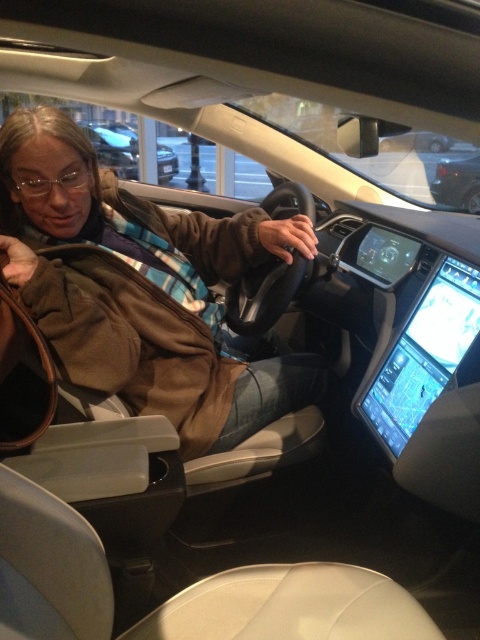
Can you confirm if metallic silver car at upper center is positioned below shiny black car at upper right?

Incorrect, metallic silver car at upper center is not positioned below shiny black car at upper right.

Locate an element on the screen. The height and width of the screenshot is (640, 480). metallic silver car at upper center is located at coordinates (115, 145).

This screenshot has height=640, width=480. I want to click on metallic silver car at upper center, so click(x=115, y=145).

Between brown leather jacket at center and shiny black car at upper right, which one appears on the left side from the viewer's perspective?

brown leather jacket at center

Measure the distance between brown leather jacket at center and camera.

brown leather jacket at center and camera are 4.28 feet apart.

Is point (303, 387) closer to camera compared to point (435, 168)?

Yes, it is.

Where is `brown leather jacket at center`? The height and width of the screenshot is (640, 480). brown leather jacket at center is located at coordinates (x=142, y=288).

Who is more forward, (284, 397) or (117, 172)?

Point (284, 397) is in front.

Measure the distance between brown leather jacket at center and camera.

brown leather jacket at center and camera are 4.28 feet apart.

Locate an element on the screen. brown leather jacket at center is located at coordinates (142, 288).